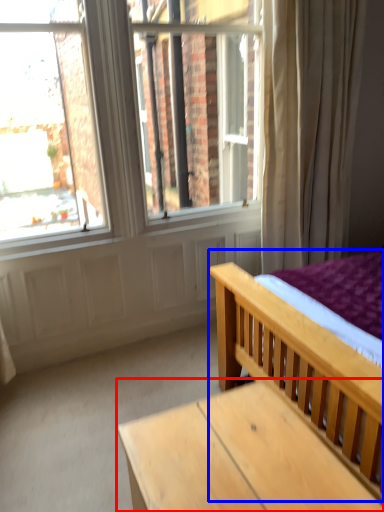
Question: Among these objects, which one is nearest to the camera, table (highlighted by a red box) or bed (highlighted by a blue box)?

Choices:
 (A) table
 (B) bed

Answer: (B)